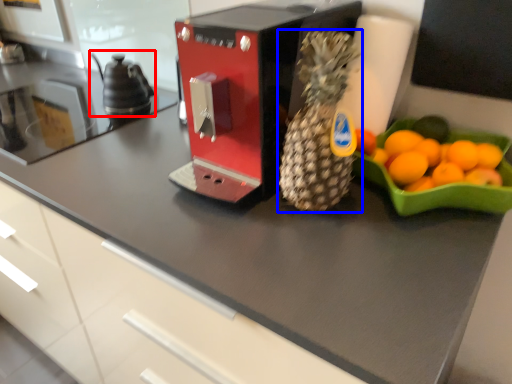
Question: Which object is further to the camera taking this photo, tea pot (highlighted by a red box) or pineapple (highlighted by a blue box)?

Choices:
 (A) tea pot
 (B) pineapple

Answer: (A)